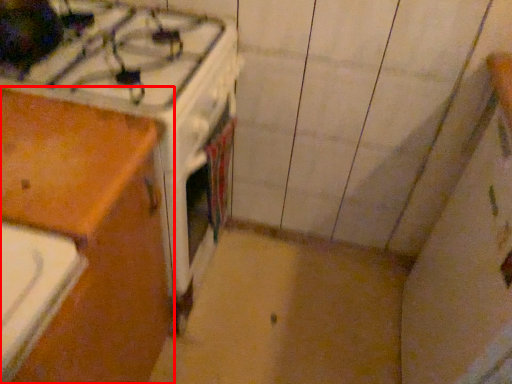
Question: In this image, where is cabinetry (annotated by the red box) located relative to gas stove?

Choices:
 (A) left
 (B) right

Answer: (A)